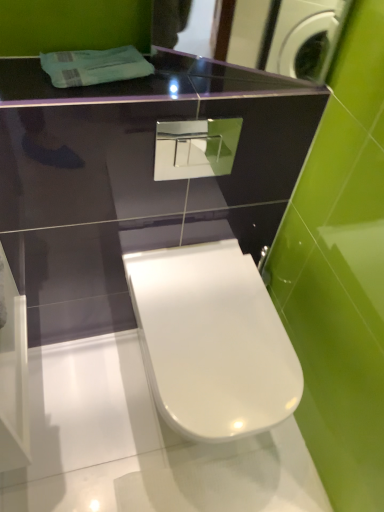
The width and height of the screenshot is (384, 512). Find the location of `vacant point above white glossy toilet at center (from a real-world perspective)`. vacant point above white glossy toilet at center (from a real-world perspective) is located at coordinates (218, 322).